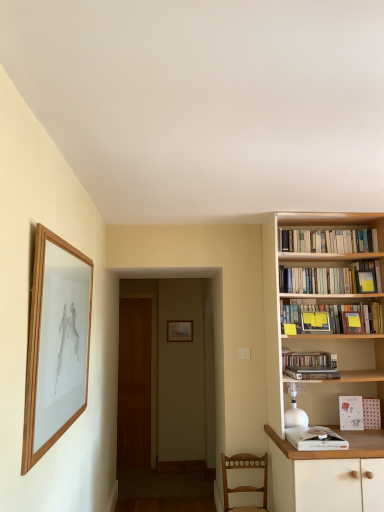
Question: From a real-world perspective, is white paperbacks at upper right, which appears as the first book when viewed from the top, physically below brown wooden door at center?

Choices:
 (A) yes
 (B) no

Answer: (B)

Question: Considering the relative sizes of white paperbacks at upper right, the sixth book positioned from the bottom, and brown wooden door at center in the image provided, is white paperbacks at upper right, the sixth book positioned from the bottom, shorter than brown wooden door at center?

Choices:
 (A) yes
 (B) no

Answer: (A)

Question: Is white paperbacks at upper right, which appears as the first book when viewed from the top, looking in the opposite direction of brown wooden door at center?

Choices:
 (A) no
 (B) yes

Answer: (A)

Question: Can you see white paperbacks at upper right, which appears as the first book when viewed from the top, touching brown wooden door at center?

Choices:
 (A) no
 (B) yes

Answer: (A)

Question: Considering the relative sizes of white paperbacks at upper right, the sixth book positioned from the bottom, and brown wooden door at center in the image provided, is white paperbacks at upper right, the sixth book positioned from the bottom, thinner than brown wooden door at center?

Choices:
 (A) yes
 (B) no

Answer: (B)

Question: Can you confirm if white paperbacks at upper right, the sixth book positioned from the bottom, is wider than brown wooden door at center?

Choices:
 (A) no
 (B) yes

Answer: (B)

Question: From the image's perspective, would you say wooden picture frame at left, which is counted as the first picture frame, starting from the front, is positioned over matte wooden picture frame at center, placed as the 1th picture frame when sorted from back to front?

Choices:
 (A) no
 (B) yes

Answer: (B)

Question: Is wooden picture frame at left, acting as the second picture frame starting from the bottom, to the right of matte wooden picture frame at center, placed as the 1th picture frame when sorted from back to front, from the viewer's perspective?

Choices:
 (A) no
 (B) yes

Answer: (A)

Question: From a real-world perspective, is wooden picture frame at left, acting as the 2th picture frame starting from the back, positioned over matte wooden picture frame at center, the second picture frame from the top, based on gravity?

Choices:
 (A) yes
 (B) no

Answer: (A)

Question: Considering the relative sizes of wooden picture frame at left, which is counted as the first picture frame, starting from the front, and matte wooden picture frame at center, the second picture frame from the top, in the image provided, is wooden picture frame at left, which is counted as the first picture frame, starting from the front, shorter than matte wooden picture frame at center, the second picture frame from the top,?

Choices:
 (A) no
 (B) yes

Answer: (A)

Question: From the image's perspective, is wooden picture frame at left, which is counted as the first picture frame, starting from the front, beneath matte wooden picture frame at center, acting as the second picture frame starting from the front?

Choices:
 (A) no
 (B) yes

Answer: (A)

Question: Can you confirm if wooden picture frame at left, acting as the 2th picture frame starting from the back, is thinner than matte wooden picture frame at center, which is the 2th picture frame in left-to-right order?

Choices:
 (A) no
 (B) yes

Answer: (A)

Question: Is white paperbacks at upper right, the sixth book positioned from the bottom, not inside hardcover books at upper right, which is counted as the second book, starting from the top?

Choices:
 (A) no
 (B) yes

Answer: (B)